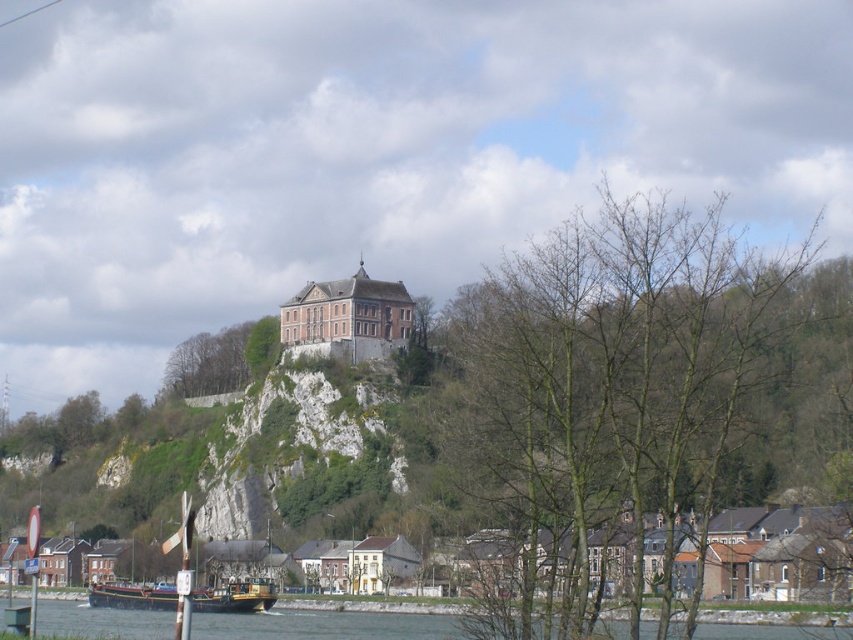
Question: Can you confirm if matte stone castle at upper center is wider than wooden polished barge at lower left?

Choices:
 (A) no
 (B) yes

Answer: (A)

Question: Considering the real-world distances, which object is closest to the matte stone castle at upper center?

Choices:
 (A) wooden polished barge at lower left
 (B) bare branches at center
 (C) blue-green water at lower left

Answer: (B)

Question: Which of the following is the farthest from the observer?

Choices:
 (A) (207, 372)
 (B) (364, 272)

Answer: (A)

Question: Can you confirm if brown brick houses at lower center is smaller than matte stone castle at upper center?

Choices:
 (A) yes
 (B) no

Answer: (B)

Question: Which of the following is the farthest from the observer?

Choices:
 (A) (106, 604)
 (B) (566, 464)
 (C) (799, 554)

Answer: (A)

Question: Can you confirm if blue-green water at lower left is thinner than green leafy tree at upper center?

Choices:
 (A) no
 (B) yes

Answer: (A)